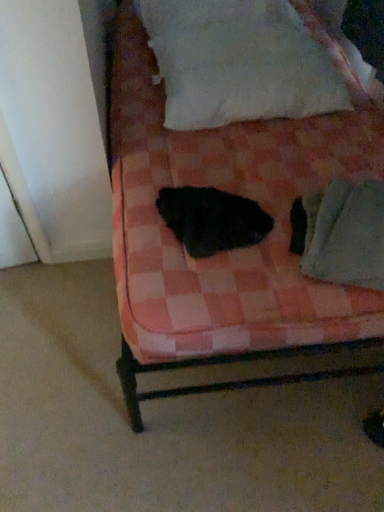
The width and height of the screenshot is (384, 512). What are the coordinates of `white cotton pillow at upper center` in the screenshot? It's located at (238, 62).

I want to click on pink checkered fabric at center, so (230, 252).

What is the approximate height of green fabric at lower right?

7.07 inches.

Where is `green fabric at lower right`? Image resolution: width=384 pixels, height=512 pixels. green fabric at lower right is located at coordinates (345, 234).

The height and width of the screenshot is (512, 384). In order to click on white cotton pillow at upper center in this screenshot , I will do `click(238, 62)`.

Can you confirm if black fuzzy cat at center is positioned to the right of white cotton pillow at upper center?

No.

Would you consider black fuzzy cat at center to be distant from white cotton pillow at upper center?

No.

Is black fuzzy cat at center thinner than white cotton pillow at upper center?

Indeed, black fuzzy cat at center has a lesser width compared to white cotton pillow at upper center.

From the image's perspective, is pink checkered fabric at center under black fuzzy cat at center?

Incorrect, from the image's perspective, pink checkered fabric at center is higher than black fuzzy cat at center.

Would you say pink checkered fabric at center is inside or outside black fuzzy cat at center?

pink checkered fabric at center lies outside black fuzzy cat at center.

Is pink checkered fabric at center far from black fuzzy cat at center?

Actually, pink checkered fabric at center and black fuzzy cat at center are a little close together.

Between point (297, 45) and point (170, 161), which one is positioned in front?

Positioned in front is point (170, 161).

Is white cotton pillow at upper center inside the boundaries of pink checkered fabric at center, or outside?

white cotton pillow at upper center is spatially positioned inside pink checkered fabric at center.

Is white cotton pillow at upper center not close to pink checkered fabric at center?

They are positioned close to each other.

From the image's perspective, is white cotton pillow at upper center over pink checkered fabric at center?

Correct, white cotton pillow at upper center appears higher than pink checkered fabric at center in the image.

Which is more to the left, pink checkered fabric at center or green fabric at lower right?

Positioned to the left is pink checkered fabric at center.

Considering the sizes of pink checkered fabric at center and green fabric at lower right in the image, is pink checkered fabric at center wider or thinner than green fabric at lower right?

In the image, pink checkered fabric at center appears to be wider than green fabric at lower right.

Is pink checkered fabric at center not within green fabric at lower right?

pink checkered fabric at center is positioned outside green fabric at lower right.

Is point (355, 295) closer or farther from the camera than point (330, 246)?

Clearly, point (355, 295) is more distant from the camera than point (330, 246).

Consider the image. Which of these two, white cotton pillow at upper center or black fuzzy cat at center, is smaller?

black fuzzy cat at center is smaller.

Between point (330, 84) and point (263, 232), which one is positioned behind?

The point (330, 84) is farther.

Considering the sizes of white cotton pillow at upper center and black fuzzy cat at center in the image, is white cotton pillow at upper center taller or shorter than black fuzzy cat at center?

In the image, white cotton pillow at upper center appears to be taller than black fuzzy cat at center.

From the image's perspective, is white cotton pillow at upper center positioned above or below black fuzzy cat at center?

white cotton pillow at upper center is above black fuzzy cat at center.

From the image's perspective, which object appears higher, green fabric at lower right or pink checkered fabric at center?

pink checkered fabric at center.

From a real-world perspective, is green fabric at lower right physically located above or below pink checkered fabric at center?

green fabric at lower right is below pink checkered fabric at center.

Considering the sizes of green fabric at lower right and pink checkered fabric at center in the image, is green fabric at lower right taller or shorter than pink checkered fabric at center?

green fabric at lower right is shorter than pink checkered fabric at center.

What are the coordinates of `linen behind the pink checkered fabric at center` in the screenshot? It's located at (345, 234).

Does black fuzzy cat at center have a larger size compared to pink checkered fabric at center?

Incorrect, black fuzzy cat at center is not larger than pink checkered fabric at center.

Who is taller, black fuzzy cat at center or pink checkered fabric at center?

pink checkered fabric at center is taller.

Which point is more forward, (267, 226) or (136, 255)?

Point (136, 255)

Consider the image. From a real-world perspective, does black fuzzy cat at center stand above pink checkered fabric at center?

No.

The image size is (384, 512). In order to click on animal that appears below the white cotton pillow at upper center (from a real-world perspective) in this screenshot , I will do `click(212, 219)`.

This screenshot has width=384, height=512. Identify the location of animal below the pink checkered fabric at center (from the image's perspective). (212, 219).

When comparing their distances from black fuzzy cat at center, does green fabric at lower right or pink checkered fabric at center seem closer?

green fabric at lower right lies closer to black fuzzy cat at center than the other object.

Which object lies nearer to the anchor point pink checkered fabric at center, green fabric at lower right or black fuzzy cat at center?

black fuzzy cat at center is closer to pink checkered fabric at center.

Looking at this image, looking at the image, which one is located closer to green fabric at lower right, white cotton pillow at upper center or black fuzzy cat at center?

black fuzzy cat at center is closer to green fabric at lower right.

Looking at this image, which object lies nearer to the anchor point black fuzzy cat at center, pink checkered fabric at center or green fabric at lower right?

Among the two, green fabric at lower right is located nearer to black fuzzy cat at center.

Looking at the image, which one is located further to white cotton pillow at upper center, black fuzzy cat at center or pink checkered fabric at center?

Based on the image, black fuzzy cat at center appears to be further to white cotton pillow at upper center.

Estimate the real-world distances between objects in this image. Which object is closer to white cotton pillow at upper center, pink checkered fabric at center or green fabric at lower right?

pink checkered fabric at center is closer to white cotton pillow at upper center.

When comparing their distances from white cotton pillow at upper center, does green fabric at lower right or black fuzzy cat at center seem further?

Among the two, green fabric at lower right is located further to white cotton pillow at upper center.

Based on their spatial positions, is pink checkered fabric at center or black fuzzy cat at center further from green fabric at lower right?

Among the two, pink checkered fabric at center is located further to green fabric at lower right.

The width and height of the screenshot is (384, 512). In order to click on animal that lies between white cotton pillow at upper center and green fabric at lower right from top to bottom in this screenshot , I will do `click(212, 219)`.

Where is `linen positioned between pink checkered fabric at center and black fuzzy cat at center from near to far`? This screenshot has height=512, width=384. linen positioned between pink checkered fabric at center and black fuzzy cat at center from near to far is located at coordinates (345, 234).

Locate an element on the screen. animal between pink checkered fabric at center and white cotton pillow at upper center in the front-back direction is located at coordinates (212, 219).

Where is `linen between pink checkered fabric at center and white cotton pillow at upper center from front to back`? The height and width of the screenshot is (512, 384). linen between pink checkered fabric at center and white cotton pillow at upper center from front to back is located at coordinates [345, 234].